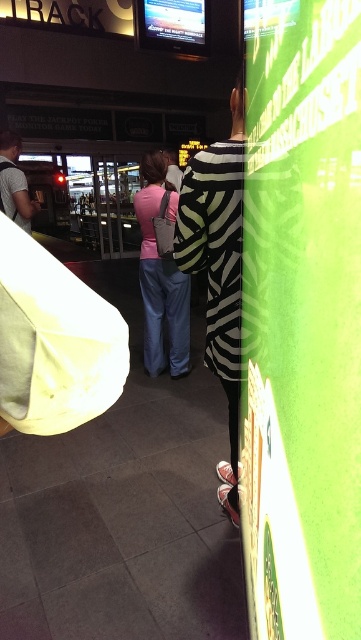
Question: Is zebra-patterned dress at center below matte gray shirt at left?

Choices:
 (A) no
 (B) yes

Answer: (B)

Question: Is zebra-patterned dress at center to the left of matte gray shirt at left from the viewer's perspective?

Choices:
 (A) yes
 (B) no

Answer: (B)

Question: Which point appears closest to the camera in this image?

Choices:
 (A) (6, 179)
 (B) (189, 218)
 (C) (180, 292)

Answer: (B)

Question: Which of the following is the farthest from the observer?

Choices:
 (A) (232, 419)
 (B) (180, 358)
 (C) (25, 211)

Answer: (B)

Question: Which of these objects is positioned closest to the matte gray shirt at left?

Choices:
 (A) zebra-patterned dress at center
 (B) pink fabric purse at center

Answer: (B)

Question: Does zebra-patterned dress at center appear on the left side of pink fabric purse at center?

Choices:
 (A) no
 (B) yes

Answer: (A)